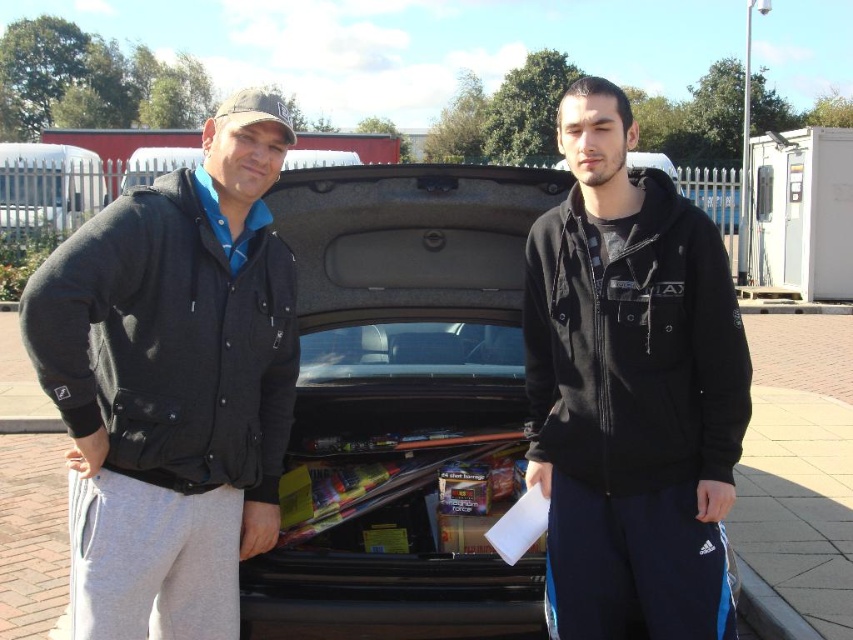
Question: Which point is closer to the camera?

Choices:
 (A) (730, 600)
 (B) (109, 577)

Answer: (B)

Question: Can you confirm if dark gray fleece jacket at left is thinner than black fleece jacket at center?

Choices:
 (A) yes
 (B) no

Answer: (B)

Question: Can you confirm if dark gray fleece jacket at left is bigger than black fleece jacket at center?

Choices:
 (A) no
 (B) yes

Answer: (B)

Question: Is the position of dark gray fleece jacket at left more distant than that of black fleece jacket at center?

Choices:
 (A) no
 (B) yes

Answer: (A)